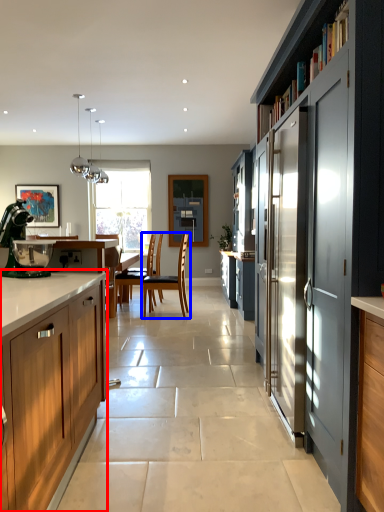
Question: Which point is further to the camera, cabinetry (highlighted by a red box) or chair (highlighted by a blue box)?

Choices:
 (A) cabinetry
 (B) chair

Answer: (B)